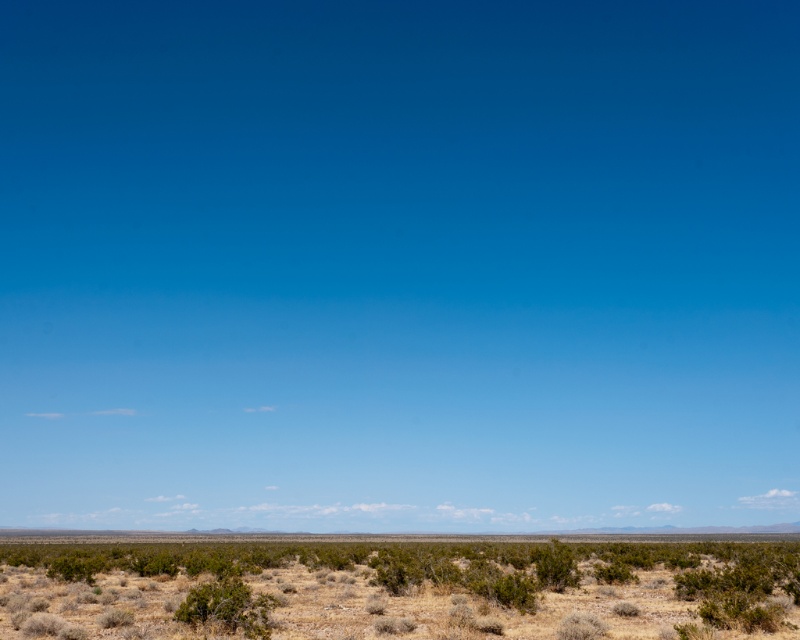
Question: Which point appears closest to the camera in this image?

Choices:
 (A) (208, 538)
 (B) (540, 634)

Answer: (B)

Question: Is dry shrubbery at lower center closer to camera compared to brown dirt at center?

Choices:
 (A) yes
 (B) no

Answer: (A)

Question: Which object is farther from the camera taking this photo?

Choices:
 (A) brown dirt at center
 (B) dry shrubbery at lower center

Answer: (A)

Question: Is dry shrubbery at lower center to the left of brown dirt at center from the viewer's perspective?

Choices:
 (A) no
 (B) yes

Answer: (A)

Question: Is dry shrubbery at lower center below brown dirt at center?

Choices:
 (A) yes
 (B) no

Answer: (B)